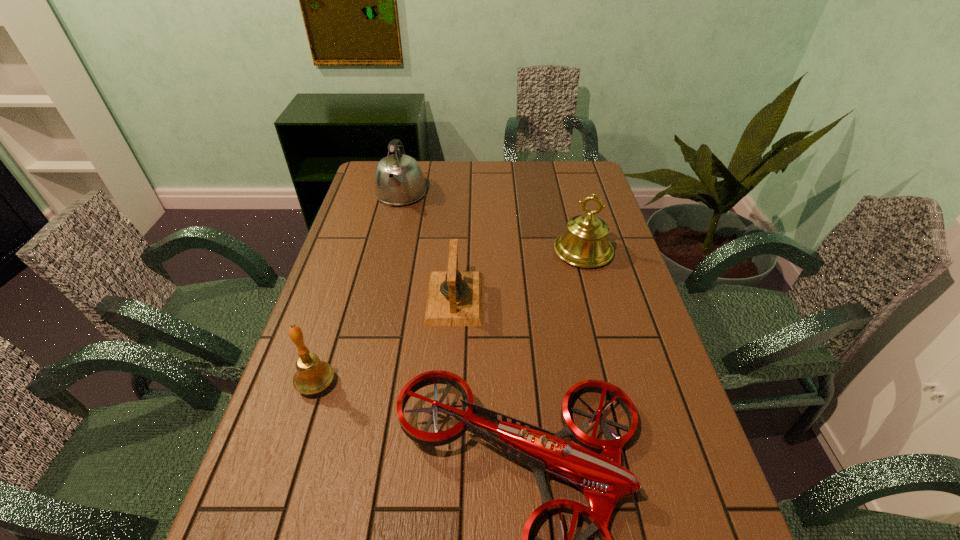
At what (x,y) coordinates should I click in order to perform the action: click on vacant space that satisfies the following two spatial constraints: 1. on the back side of the rightmost bell; 2. on the left side of the leftmost bell. Please return your answer as a coordinate pair (x, y). Looking at the image, I should click on pyautogui.click(x=358, y=251).